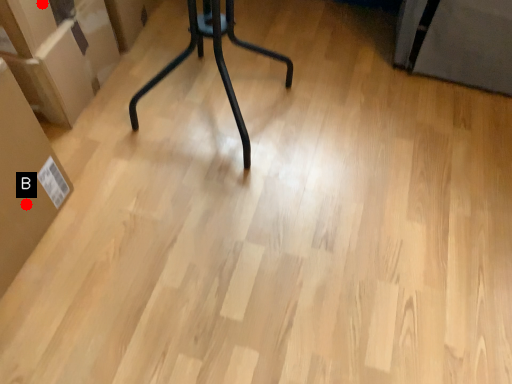
Question: Two points are circled on the image, labeled by A and B beside each circle. Which point is farther to the camera?

Choices:
 (A) A is further
 (B) B is further

Answer: (A)